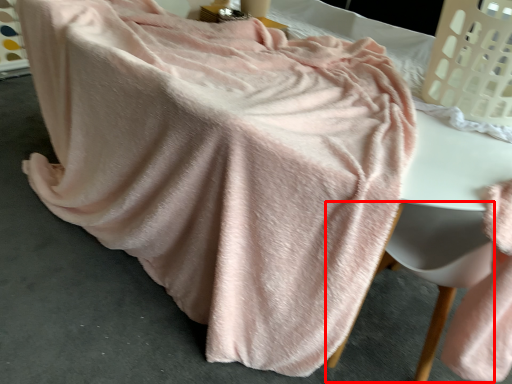
Question: Considering the relative positions of swivel chair (annotated by the red box) and laundry basket in the image provided, where is swivel chair (annotated by the red box) located with respect to the staircase?

Choices:
 (A) left
 (B) right

Answer: (A)